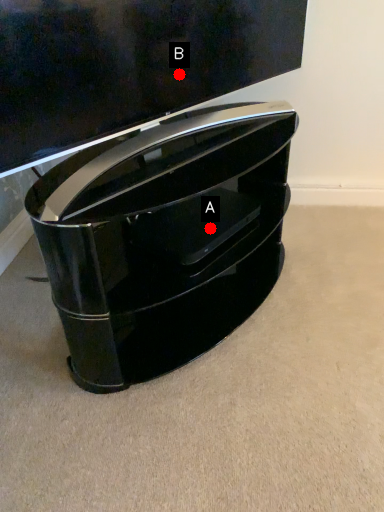
Question: Two points are circled on the image, labeled by A and B beside each circle. Which point appears farthest from the camera in this image?

Choices:
 (A) A is further
 (B) B is further

Answer: (A)